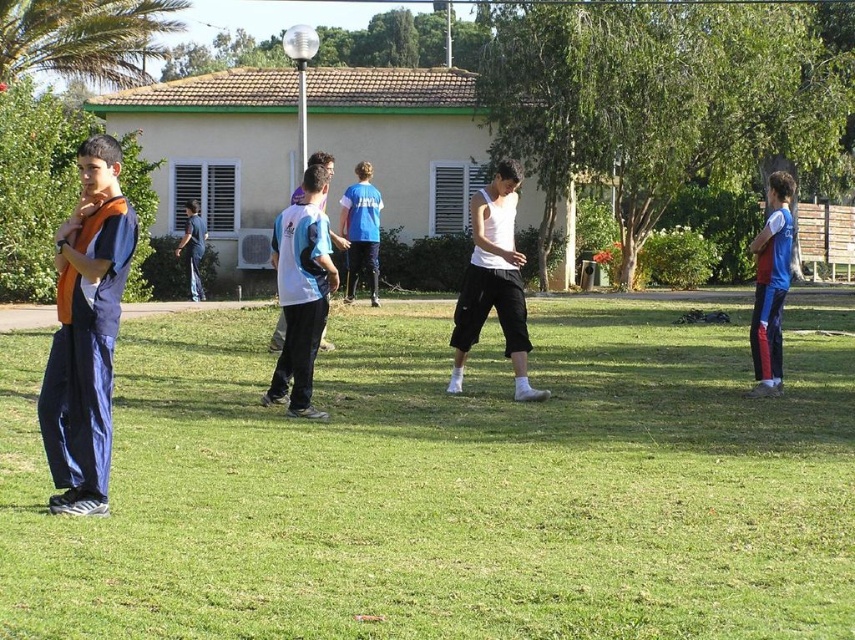
You are organizing a sports event and need to arrange participants based on their clothing size. Given the matte blue tracksuit at left and the white matte tank top at center, which participant should you place in a larger designated area?

The white matte tank top at center should be placed in a larger designated area because the matte blue tracksuit at left occupies less space than it.

You are standing at the point with coordinates point (771, 205) and want to walk towards the point (68, 452). Will you have to walk through any of the people in the scene?

Point (68, 452) is in front of point (771, 205), so yes, you will have to walk through the people in the scene since the path between them would require passing through the individuals positioned between those points.

You are a sports coach planning to move two players closer to each other for a drill. The white jersey at center and the white matte tank top at center are currently 1.82 meters apart. If you want them to be 1 meter apart, how much distance should they reduce?

The players need to reduce the distance between the white jersey at center and the white matte tank top at center by 0.82 meters to achieve the desired 1 meter separation.